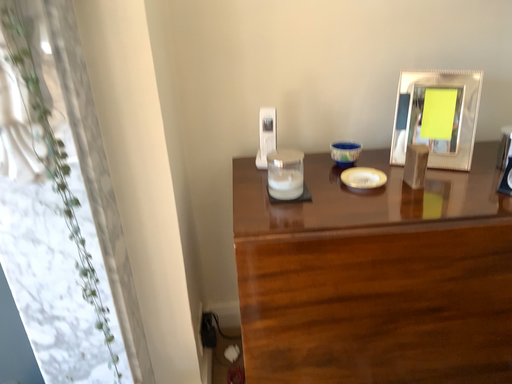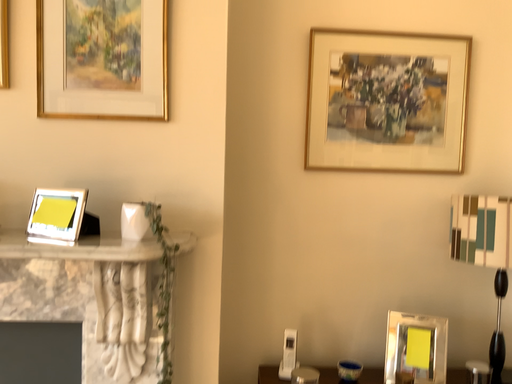
Question: Which way did the camera rotate in the video?

Choices:
 (A) rotated downward
 (B) rotated upward

Answer: (B)